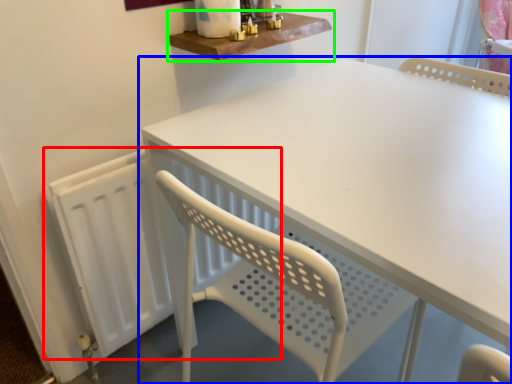
Question: Which object is the farthest from radiator (highlighted by a red box)? Choose among these: table (highlighted by a blue box) or shelf (highlighted by a green box).

Choices:
 (A) table
 (B) shelf

Answer: (B)